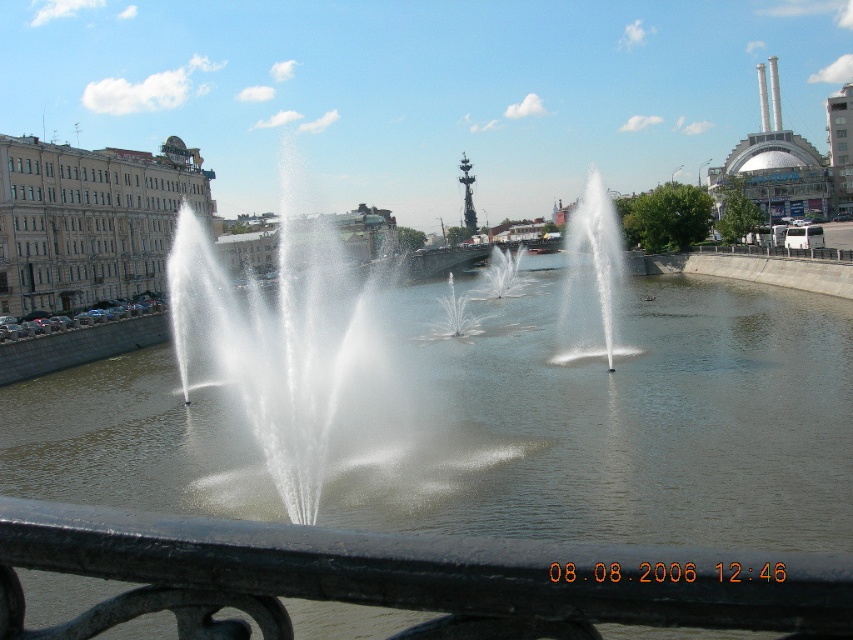
You are standing in a park and want to take a photo of the brown concrete river at center. If the camera you are using has a minimum focusing distance of 10 meters, will you need to move closer or farther away to ensure the river is in focus?

The brown concrete river at center is 86.62 feet away from the camera. Since 86.62 feet is approximately 26.4 meters, which is greater than the camera minimum focusing distance of 10 meters, you do not need to move closer. The camera can focus on the river at this distance.

You are a tourist standing at the edge of the water, looking at the black metal rail at lower center and the white frothy water at center. Which object is taller from your viewpoint?

The white frothy water at center is taller than the black metal rail at lower center.